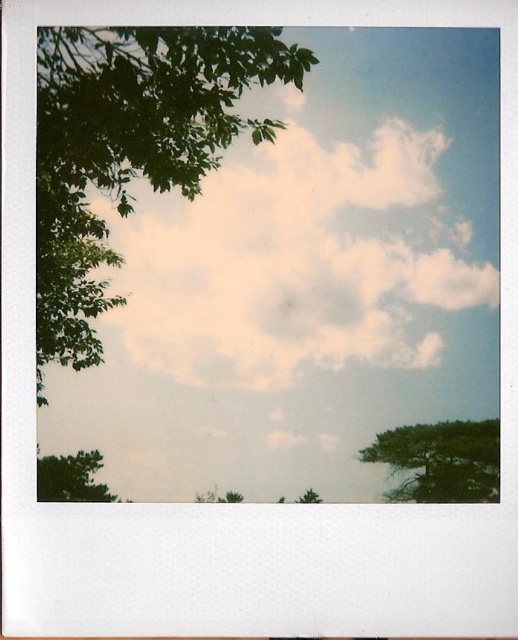
Looking at this image, how much distance is there between white fluffy cloud at upper center and green leafy tree at lower center?

white fluffy cloud at upper center is 24.94 inches away from green leafy tree at lower center.

Can you confirm if white fluffy cloud at upper center is thinner than green leafy tree at lower center?

In fact, white fluffy cloud at upper center might be wider than green leafy tree at lower center.

In order to click on white fluffy cloud at upper center in this screenshot , I will do `click(297, 260)`.

I want to click on white fluffy cloud at upper center, so click(x=297, y=260).

Does white fluffy cloud at upper center have a smaller size compared to green matte tree at lower left?

Incorrect, white fluffy cloud at upper center is not smaller in size than green matte tree at lower left.

Is white fluffy cloud at upper center further to camera compared to green matte tree at lower left?

Yes, white fluffy cloud at upper center is further from the viewer.

Locate an element on the screen. white fluffy cloud at upper center is located at coordinates (297, 260).

Does green matte tree at lower right have a lesser height compared to green leafy tree at lower center?

No, green matte tree at lower right is not shorter than green leafy tree at lower center.

Between green matte tree at lower right and green leafy tree at lower center, which one appears on the left side from the viewer's perspective?

green leafy tree at lower center is more to the left.

Is point (459, 490) more distant than point (308, 500)?

No, it is in front of (308, 500).

This screenshot has width=518, height=640. I want to click on green matte tree at lower right, so click(440, 460).